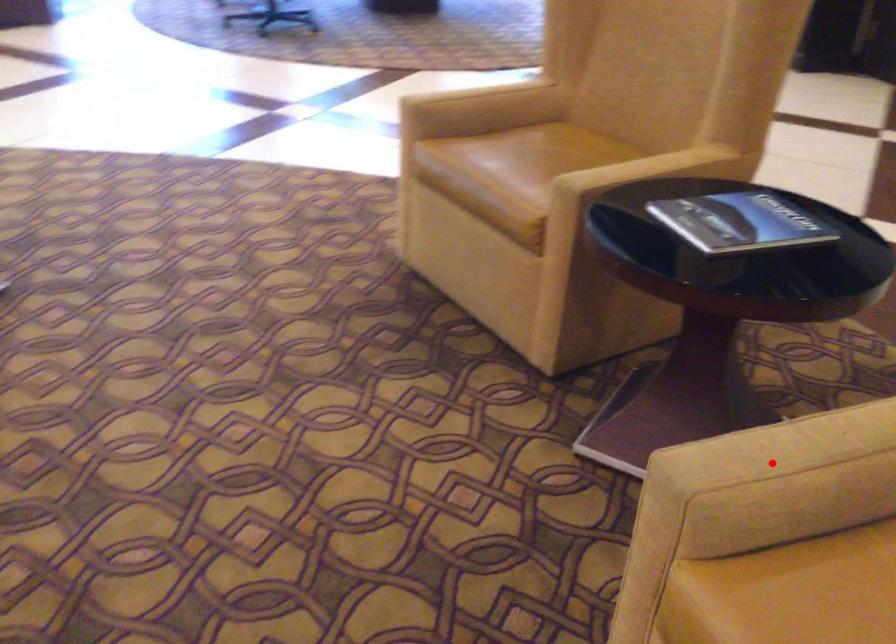
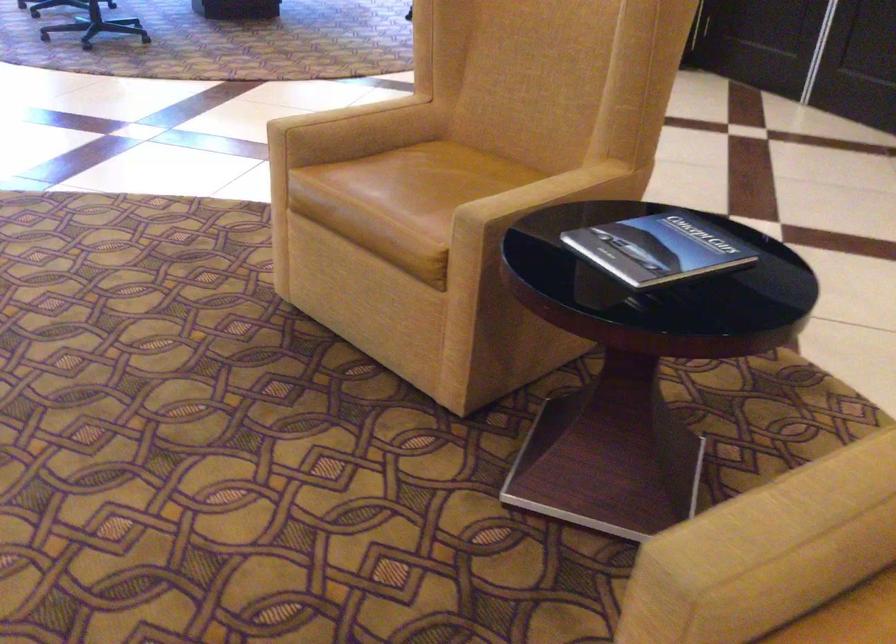
Question: I am providing you with two images of the same scene from different viewpoints. In image1, a red point is highlighted. Considering the same 3D point in image2, which of the following is correct?

Choices:
 (A) It is closer
 (B) It is farther

Answer: (A)